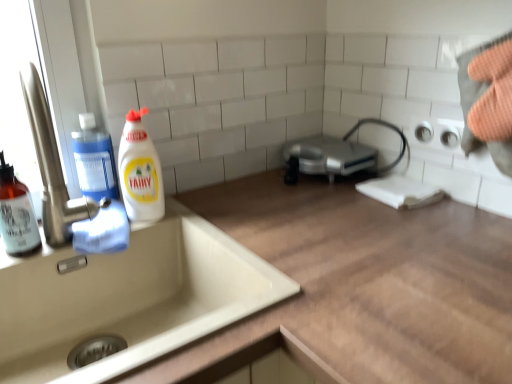
Describe the element at coordinates (94, 160) in the screenshot. I see `transparent plastic soap dispenser at left, which is the second cleaning product from right to left` at that location.

What do you see at coordinates (140, 171) in the screenshot?
I see `white glossy bottle at left, the third cleaning product viewed from the left` at bounding box center [140, 171].

Identify the location of silver metallic toaster at center. The height and width of the screenshot is (384, 512). (330, 156).

Between translucent amber bottle at left, the 1th cleaning product when ordered from left to right, and beige ceramic sink at lower left, which one has smaller size?

With smaller size is translucent amber bottle at left, the 1th cleaning product when ordered from left to right.

In the scene shown: Is translucent amber bottle at left, the 1th cleaning product when ordered from left to right, oriented towards beige ceramic sink at lower left?

No, translucent amber bottle at left, the 1th cleaning product when ordered from left to right, is not aimed at beige ceramic sink at lower left.

Would you say translucent amber bottle at left, which is the third cleaning product in right-to-left order, is to the left or to the right of beige ceramic sink at lower left in the picture?

From the image, it's evident that translucent amber bottle at left, which is the third cleaning product in right-to-left order, is to the left of beige ceramic sink at lower left.

Identify the location of sink in front of the translucent amber bottle at left, which is the third cleaning product in right-to-left order. Image resolution: width=512 pixels, height=384 pixels. (119, 281).

Is translucent amber bottle at left, which is the third cleaning product in right-to-left order, at the right side of transparent plastic soap dispenser at left, the 2th cleaning product when ordered from left to right?

Incorrect, translucent amber bottle at left, which is the third cleaning product in right-to-left order, is not on the right side of transparent plastic soap dispenser at left, the 2th cleaning product when ordered from left to right.

Is translucent amber bottle at left, which is the third cleaning product in right-to-left order, smaller than transparent plastic soap dispenser at left, which is the second cleaning product from right to left?

Correct, translucent amber bottle at left, which is the third cleaning product in right-to-left order, occupies less space than transparent plastic soap dispenser at left, which is the second cleaning product from right to left.

From the image's perspective, which one is positioned higher, translucent amber bottle at left, which is the third cleaning product in right-to-left order, or transparent plastic soap dispenser at left, the 2th cleaning product when ordered from left to right?

transparent plastic soap dispenser at left, the 2th cleaning product when ordered from left to right.

This screenshot has height=384, width=512. In order to click on cleaning product on the left of transparent plastic soap dispenser at left, the 2th cleaning product when ordered from left to right in this screenshot , I will do `click(16, 214)`.

Between white glossy bottle at left, the third cleaning product viewed from the left, and beige ceramic sink at lower left, which one appears on the right side from the viewer's perspective?

beige ceramic sink at lower left is more to the right.

Which is behind, point (121, 171) or point (106, 307)?

Positioned behind is point (121, 171).

Which of these two, white glossy bottle at left, the third cleaning product viewed from the left, or beige ceramic sink at lower left, is wider?

Wider between the two is beige ceramic sink at lower left.

Measure the distance from white glossy bottle at left, which appears as the first cleaning product when viewed from the right, to beige ceramic sink at lower left.

white glossy bottle at left, which appears as the first cleaning product when viewed from the right, is 7.68 inches away from beige ceramic sink at lower left.

Is the position of transparent plastic soap dispenser at left, which is the second cleaning product from right to left, more distant than that of translucent amber bottle at left, which is the third cleaning product in right-to-left order?

Yes, transparent plastic soap dispenser at left, which is the second cleaning product from right to left, is behind translucent amber bottle at left, which is the third cleaning product in right-to-left order.

From the transparent plastic soap dispenser at left, which is the second cleaning product from right to left, count 2nd cleaning products forward and point to it. Please provide its 2D coordinates.

[(16, 214)]

Measure the distance between transparent plastic soap dispenser at left, which is the second cleaning product from right to left, and translucent amber bottle at left, which is the third cleaning product in right-to-left order.

They are 6.44 inches apart.

Which of these two, transparent plastic soap dispenser at left, the 2th cleaning product when ordered from left to right, or translucent amber bottle at left, the 1th cleaning product when ordered from left to right, is bigger?

transparent plastic soap dispenser at left, the 2th cleaning product when ordered from left to right, is bigger.

Between beige ceramic sink at lower left and white glossy bottle at left, which appears as the first cleaning product when viewed from the right, which one appears on the right side from the viewer's perspective?

beige ceramic sink at lower left.

Considering the relative positions of beige ceramic sink at lower left and white glossy bottle at left, which appears as the first cleaning product when viewed from the right, in the image provided, is beige ceramic sink at lower left behind white glossy bottle at left, which appears as the first cleaning product when viewed from the right,?

No, beige ceramic sink at lower left is in front of white glossy bottle at left, which appears as the first cleaning product when viewed from the right.

Considering the sizes of objects beige ceramic sink at lower left and white glossy bottle at left, the third cleaning product viewed from the left, in the image provided, who is smaller, beige ceramic sink at lower left or white glossy bottle at left, the third cleaning product viewed from the left,?

Smaller between the two is white glossy bottle at left, the third cleaning product viewed from the left.

Between white glossy bottle at left, the third cleaning product viewed from the left, and translucent amber bottle at left, the 1th cleaning product when ordered from left to right, which one appears on the left side from the viewer's perspective?

Answer: Positioned to the left is translucent amber bottle at left, the 1th cleaning product when ordered from left to right.

From the image's perspective, is white glossy bottle at left, which appears as the first cleaning product when viewed from the right, beneath translucent amber bottle at left, the 1th cleaning product when ordered from left to right?

Incorrect, from the image's perspective, white glossy bottle at left, which appears as the first cleaning product when viewed from the right, is higher than translucent amber bottle at left, the 1th cleaning product when ordered from left to right.

Between point (121, 179) and point (26, 205), which one is positioned in front?

The point (26, 205) is closer.

Considering the relative positions of white glossy bottle at left, which appears as the first cleaning product when viewed from the right, and translucent amber bottle at left, which is the third cleaning product in right-to-left order, in the image provided, is white glossy bottle at left, which appears as the first cleaning product when viewed from the right, in front of translucent amber bottle at left, which is the third cleaning product in right-to-left order,?

No.

Would you consider silver metallic toaster at center to be distant from transparent plastic soap dispenser at left, the 2th cleaning product when ordered from left to right?

No, silver metallic toaster at center is in close proximity to transparent plastic soap dispenser at left, the 2th cleaning product when ordered from left to right.

Is point (362, 157) closer to viewer compared to point (81, 123)?

That is False.

Considering the sizes of objects silver metallic toaster at center and transparent plastic soap dispenser at left, the 2th cleaning product when ordered from left to right, in the image provided, who is wider, silver metallic toaster at center or transparent plastic soap dispenser at left, the 2th cleaning product when ordered from left to right,?

Wider between the two is silver metallic toaster at center.

Is silver metallic toaster at center looking in the opposite direction of transparent plastic soap dispenser at left, the 2th cleaning product when ordered from left to right?

No, transparent plastic soap dispenser at left, the 2th cleaning product when ordered from left to right, is not at the back of silver metallic toaster at center.

Locate an element on the screen. This screenshot has height=384, width=512. the 1st cleaning product positioned above the beige ceramic sink at lower left (from the image's perspective) is located at coordinates (16, 214).

Identify the location of cleaning product that is on the left side of transparent plastic soap dispenser at left, the 2th cleaning product when ordered from left to right. (16, 214).

Which object lies further to the anchor point white glossy bottle at left, the third cleaning product viewed from the left, beige ceramic sink at lower left or silver metallic toaster at center?

Among the two, silver metallic toaster at center is located further to white glossy bottle at left, the third cleaning product viewed from the left.

Which object lies nearer to the anchor point beige ceramic sink at lower left, translucent amber bottle at left, the 1th cleaning product when ordered from left to right, or silver metallic toaster at center?

Based on the image, translucent amber bottle at left, the 1th cleaning product when ordered from left to right, appears to be nearer to beige ceramic sink at lower left.

From the image, which object appears to be nearer to beige ceramic sink at lower left, translucent amber bottle at left, the 1th cleaning product when ordered from left to right, or white glossy bottle at left, which appears as the first cleaning product when viewed from the right?

white glossy bottle at left, which appears as the first cleaning product when viewed from the right, lies closer to beige ceramic sink at lower left than the other object.

Consider the image. Considering their positions, is translucent amber bottle at left, the 1th cleaning product when ordered from left to right, positioned further to white glossy bottle at left, the third cleaning product viewed from the left, than beige ceramic sink at lower left?

translucent amber bottle at left, the 1th cleaning product when ordered from left to right, is positioned further to the anchor white glossy bottle at left, the third cleaning product viewed from the left.

When comparing their distances from white glossy bottle at left, the third cleaning product viewed from the left, does silver metallic toaster at center or transparent plastic soap dispenser at left, the 2th cleaning product when ordered from left to right, seem further?

Based on the image, silver metallic toaster at center appears to be further to white glossy bottle at left, the third cleaning product viewed from the left.

Based on their spatial positions, is transparent plastic soap dispenser at left, the 2th cleaning product when ordered from left to right, or translucent amber bottle at left, which is the third cleaning product in right-to-left order, further from silver metallic toaster at center?

translucent amber bottle at left, which is the third cleaning product in right-to-left order, is positioned further to the anchor silver metallic toaster at center.

Based on their spatial positions, is transparent plastic soap dispenser at left, which is the second cleaning product from right to left, or beige ceramic sink at lower left further from white glossy bottle at left, the third cleaning product viewed from the left?

The object further to white glossy bottle at left, the third cleaning product viewed from the left, is beige ceramic sink at lower left.

Estimate the real-world distances between objects in this image. Which object is closer to white glossy bottle at left, the third cleaning product viewed from the left, transparent plastic soap dispenser at left, which is the second cleaning product from right to left, or translucent amber bottle at left, which is the third cleaning product in right-to-left order?

Among the two, transparent plastic soap dispenser at left, which is the second cleaning product from right to left, is located nearer to white glossy bottle at left, the third cleaning product viewed from the left.

Locate an element on the screen. sink between translucent amber bottle at left, which is the third cleaning product in right-to-left order, and silver metallic toaster at center, in the horizontal direction is located at coordinates (119, 281).

At what (x,y) coordinates should I click in order to perform the action: click on cleaning product between transparent plastic soap dispenser at left, which is the second cleaning product from right to left, and silver metallic toaster at center, in the horizontal direction. Please return your answer as a coordinate pair (x, y). This screenshot has width=512, height=384. Looking at the image, I should click on 140,171.

The image size is (512, 384). What are the coordinates of `cleaning product situated between translucent amber bottle at left, the 1th cleaning product when ordered from left to right, and white glossy bottle at left, which appears as the first cleaning product when viewed from the right, from left to right` in the screenshot? It's located at [x=94, y=160].

Identify the location of cleaning product positioned between beige ceramic sink at lower left and white glossy bottle at left, which appears as the first cleaning product when viewed from the right, from near to far. This screenshot has height=384, width=512. (16, 214).